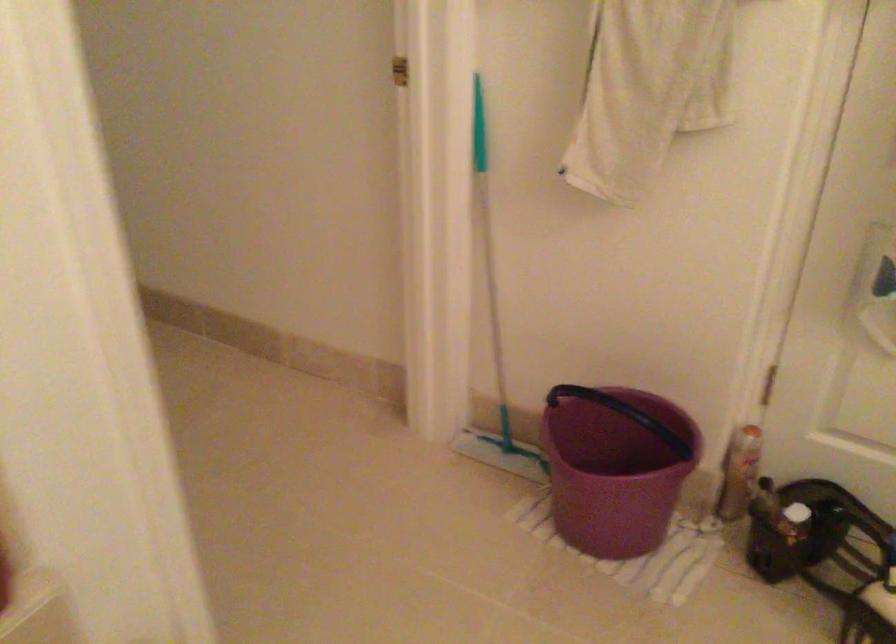
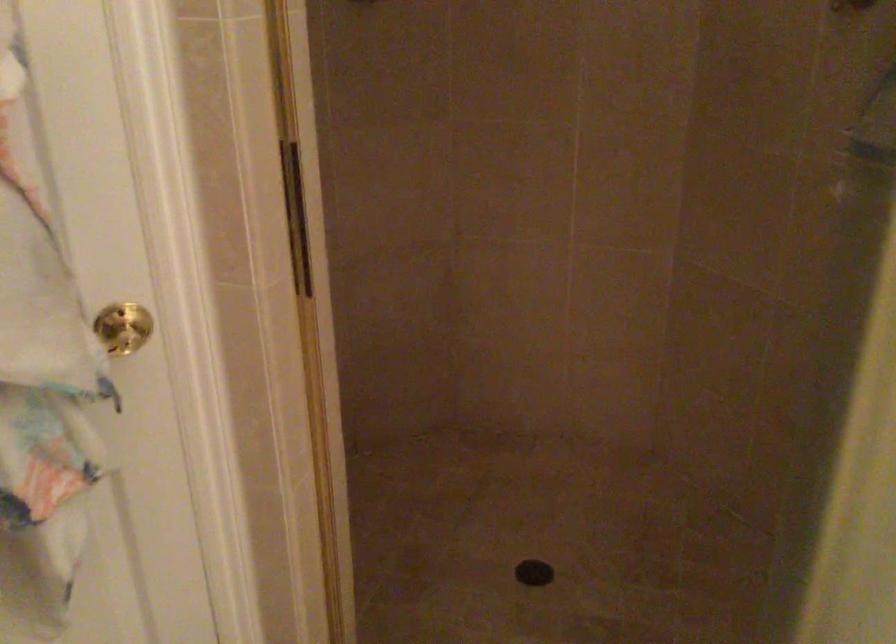
Question: The camera is either moving clockwise (left) or counter-clockwise (right) around the object. The first image is from the beginning of the video and the second image is from the end. Is the camera moving left or right when shooting the video?

Choices:
 (A) Left
 (B) Right

Answer: (A)